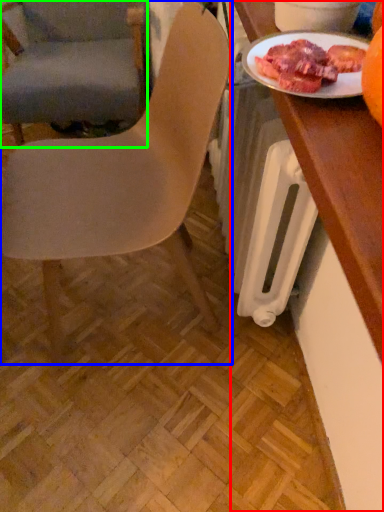
Question: Which object is positioned closest to desk (highlighted by a red box)? Select from chair (highlighted by a blue box) and chair (highlighted by a green box).

Choices:
 (A) chair
 (B) chair

Answer: (A)